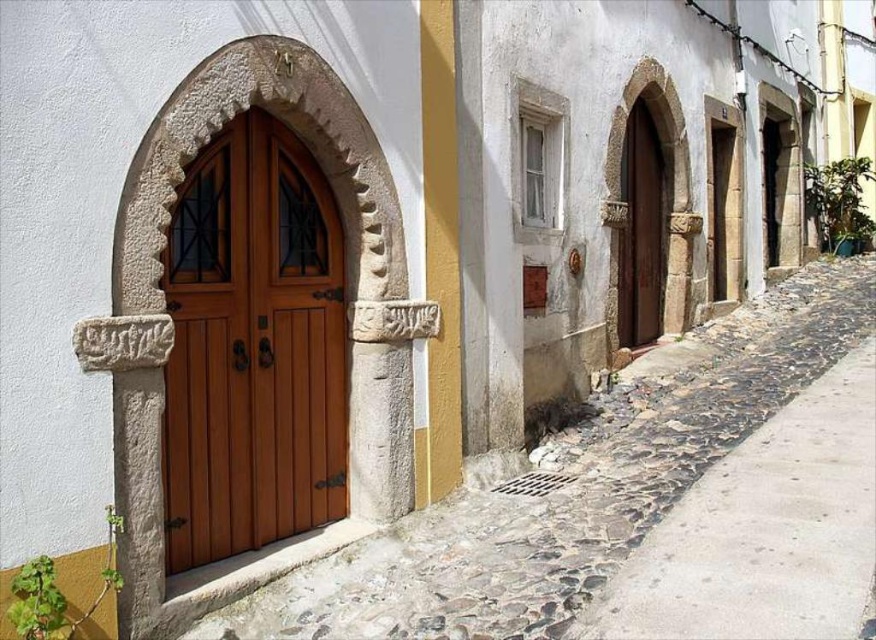
Does cobblestone alley at center have a smaller size compared to wooden door at center?

Actually, cobblestone alley at center might be larger than wooden door at center.

Is cobblestone alley at center to the right of wooden door at center from the viewer's perspective?

Correct, you'll find cobblestone alley at center to the right of wooden door at center.

Is point (489, 621) behind point (191, 280)?

No, (489, 621) is closer to viewer.

You are a GUI agent. You are given a task and a screenshot of the screen. Output one action in this format:
    pyautogui.click(x=<x>, y=<y>)
    Task: Click on the cobblestone alley at center
    This screenshot has width=876, height=640.
    Given the screenshot: What is the action you would take?
    pos(573,486)

Is point (262, 368) positioned after point (652, 180)?

No.

Does wooden door at center have a lesser width compared to brown wooden door at center?

In fact, wooden door at center might be wider than brown wooden door at center.

Is point (295, 192) farther from camera compared to point (639, 113)?

No, it is in front of (639, 113).

You are a GUI agent. You are given a task and a screenshot of the screen. Output one action in this format:
    pyautogui.click(x=<x>, y=<y>)
    Task: Click on the wooden door at center
    
    Given the screenshot: What is the action you would take?
    pyautogui.click(x=252, y=348)

Who is positioned more to the left, cobblestone alley at center or brown wooden door at center?

Positioned to the left is cobblestone alley at center.

Does cobblestone alley at center have a greater width compared to brown wooden door at center?

Indeed, cobblestone alley at center has a greater width compared to brown wooden door at center.

Is point (747, 308) farther from camera compared to point (644, 340)?

That is True.

Where is `cobblestone alley at center`? This screenshot has width=876, height=640. cobblestone alley at center is located at coordinates (573, 486).